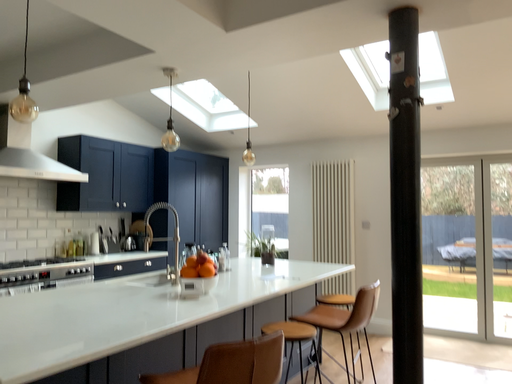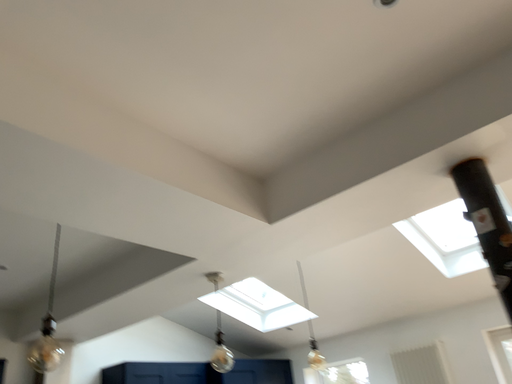
Question: How did the camera likely rotate when shooting the video?

Choices:
 (A) rotated right
 (B) rotated left

Answer: (B)